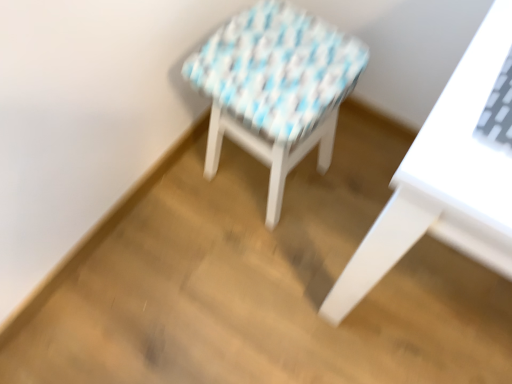
Find the location of a particular element. This screenshot has height=384, width=512. free location to the right of white woven stool at center is located at coordinates (349, 178).